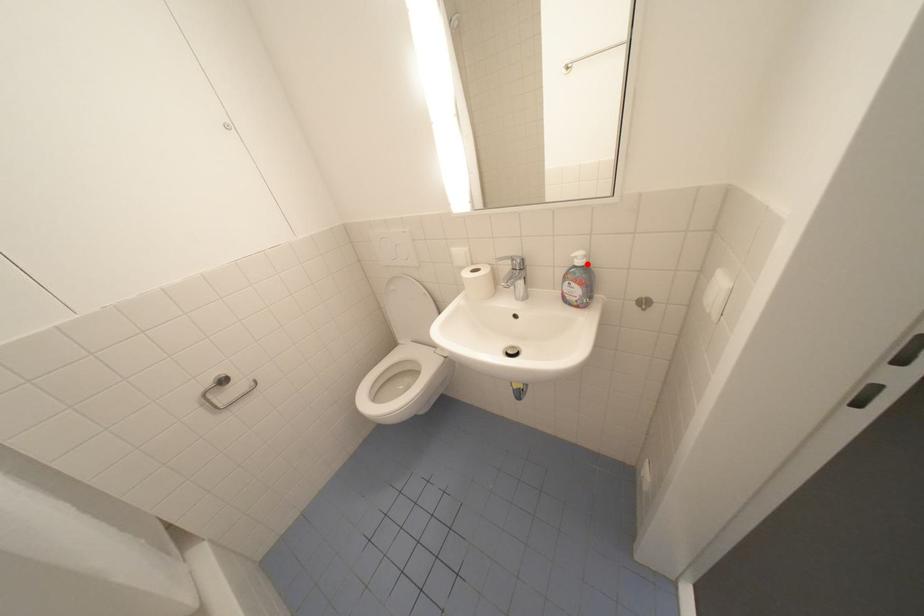
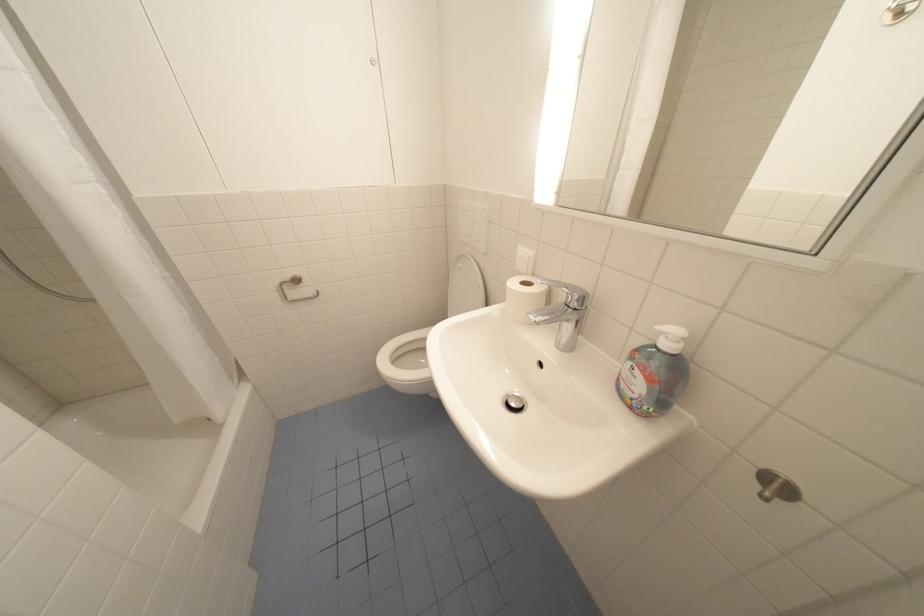
Locate, in the second image, the point that corresponds to the highlighted location in the first image.

(675, 347)